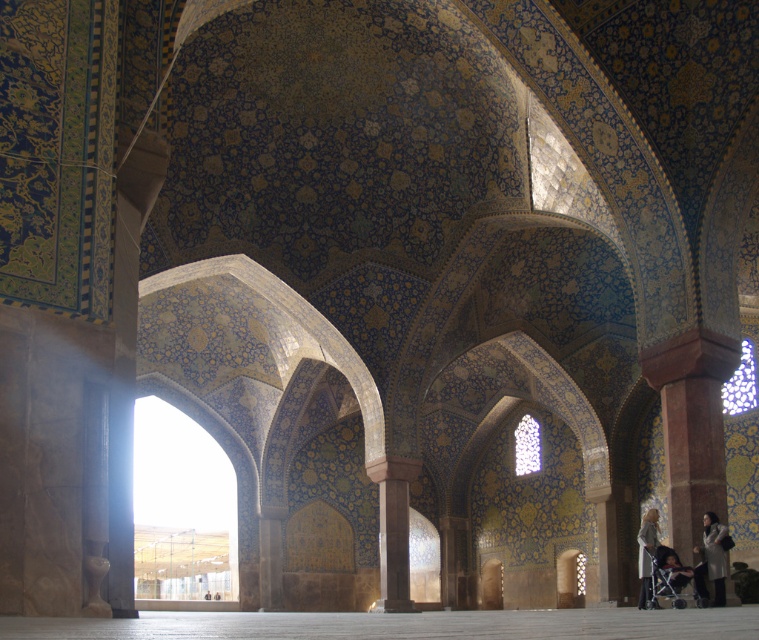
Question: Is the position of metallic silver baby carriage at lower right more distant than that of gray wool coat at lower right?

Choices:
 (A) no
 (B) yes

Answer: (A)

Question: Which of the following is the farthest from the observer?

Choices:
 (A) (638, 566)
 (B) (666, 557)
 (C) (707, 554)
 (D) (389, 477)

Answer: (A)

Question: Is brown stone column at center wider than silver metallic coat at lower right?

Choices:
 (A) no
 (B) yes

Answer: (B)

Question: Does brown stone column at center have a lesser width compared to gray wool coat at lower right?

Choices:
 (A) no
 (B) yes

Answer: (B)

Question: Which point is closer to the camera taking this photo?

Choices:
 (A) [x=652, y=536]
 (B) [x=402, y=532]

Answer: (A)

Question: Based on their relative distances, which object is nearer to the gray wool coat at lower right?

Choices:
 (A) brown stone column at center
 (B) metallic silver baby carriage at lower right

Answer: (B)